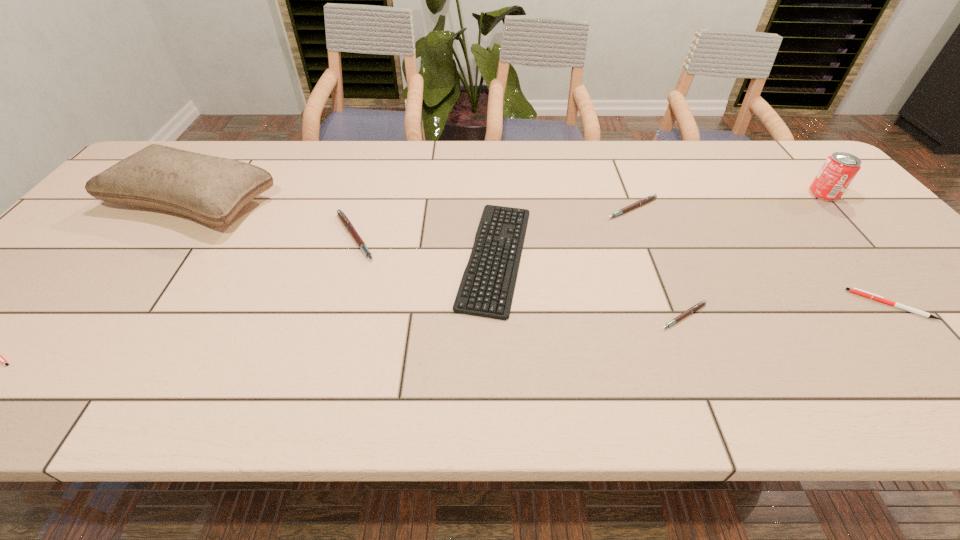
The image size is (960, 540). In order to click on the rightmost pen in this screenshot , I will do `click(854, 290)`.

This screenshot has width=960, height=540. Identify the location of free space located 0.350m on the front of the cushion. (81, 357).

Identify the location of vacant area situated 0.080m on the left of the can. The width and height of the screenshot is (960, 540). (781, 194).

You are a GUI agent. You are given a task and a screenshot of the screen. Output one action in this format:
    pyautogui.click(x=<x>, y=<y>)
    Task: Click on the vacant space located 0.310m at the nib of the biggest pink pen
    This screenshot has width=960, height=540.
    Given the screenshot: What is the action you would take?
    coord(500,237)

The width and height of the screenshot is (960, 540). What are the coordinates of `vacant space located at the nib of the second biggest pink pen` in the screenshot? It's located at (663, 288).

Identify the location of vacant point located on the left of the computer keyboard. click(435, 256).

At what (x,y) coordinates should I click in order to perform the action: click on free space located 0.080m at the nib of the smallest pink pen. Please return your answer as a coordinate pair (x, y). Looking at the image, I should click on (704, 362).

Image resolution: width=960 pixels, height=540 pixels. What are the coordinates of `vacant space located on the clicker of the bigger white pen` in the screenshot? It's located at (743, 305).

At what (x,y) coordinates should I click in order to perform the action: click on vacant area located 0.230m on the clicker of the bigger white pen. Please return your answer as a coordinate pair (x, y). The image size is (960, 540). Looking at the image, I should click on [753, 305].

At what (x,y) coordinates should I click in order to perform the action: click on free point located 0.230m on the clicker of the bigger white pen. Please return your answer as a coordinate pair (x, y). Image resolution: width=960 pixels, height=540 pixels. Looking at the image, I should click on (753, 305).